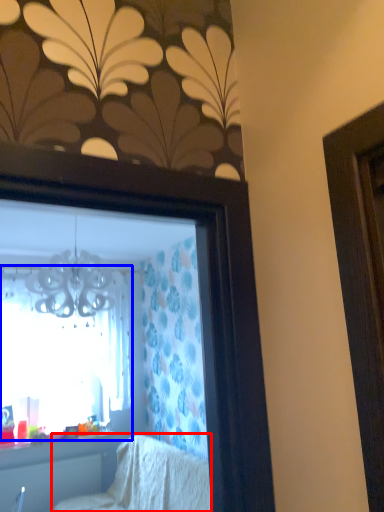
Question: Which of the following is the farthest to the observer, furniture (highlighted by a red box) or window (highlighted by a blue box)?

Choices:
 (A) furniture
 (B) window

Answer: (B)